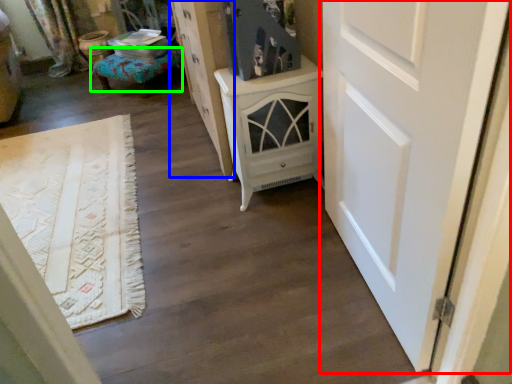
Question: Considering the real-world distances, which object is closest to door (highlighted by a red box)? cabinetry (highlighted by a blue box) or furniture (highlighted by a green box).

Choices:
 (A) cabinetry
 (B) furniture

Answer: (A)